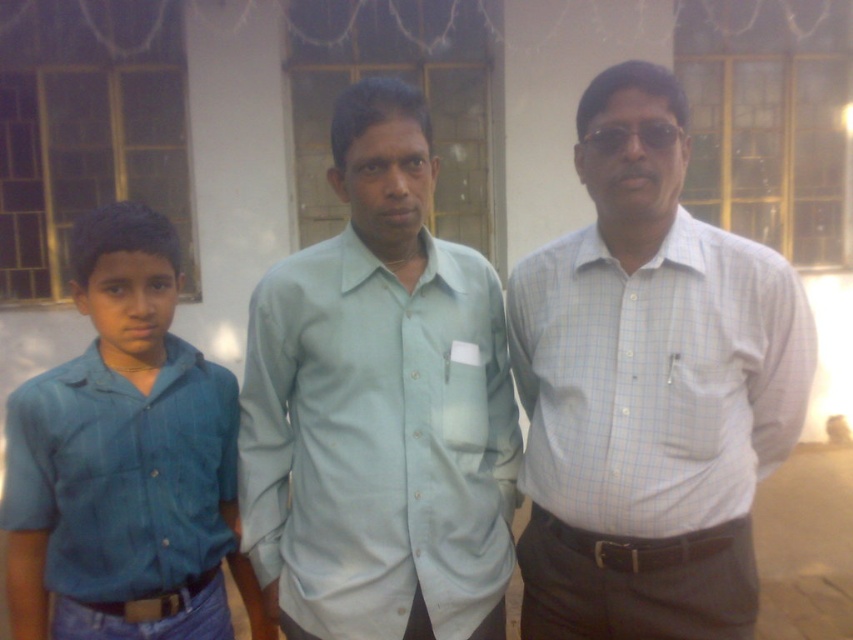
You are a photographer trying to capture a group photo of the white checkered shirt at center and the blue denim shirt at left. Since you want to ensure both subjects are in focus, which subject should you focus on first to maximize depth of field?

You should focus on the white checkered shirt at center first because it is closer to the viewer than the blue denim shirt at left, so focusing on the closer subject will help ensure both are in focus.

You are standing in front of the building with large windows and need to locate the white checkered shirt at center. According to the coordinates provided, where exactly would you look to find it?

The white checkered shirt at center is located at point 0.608 on the x axis and 0.762 on the y axis.

You are a photographer trying to capture a group photo of the two people in the center wearing white checkered shirt at center and light blue cotton shirt at center. Since you want to ensure both are in focus, which one should you focus on first to ensure the other is also in focus?

The white checkered shirt at center is in front of the light blue cotton shirt at center, so you should focus on the white checkered shirt at center first to ensure both are in focus.